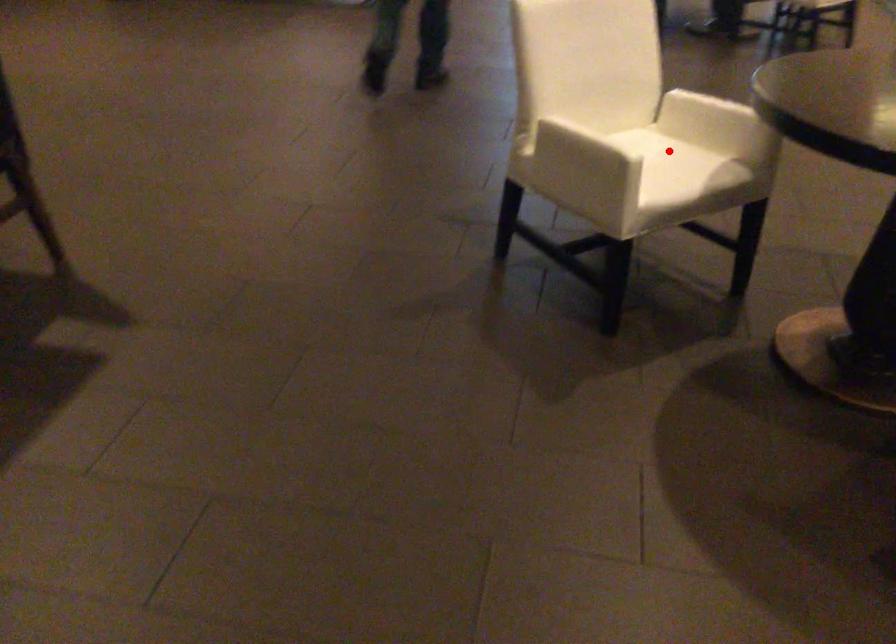
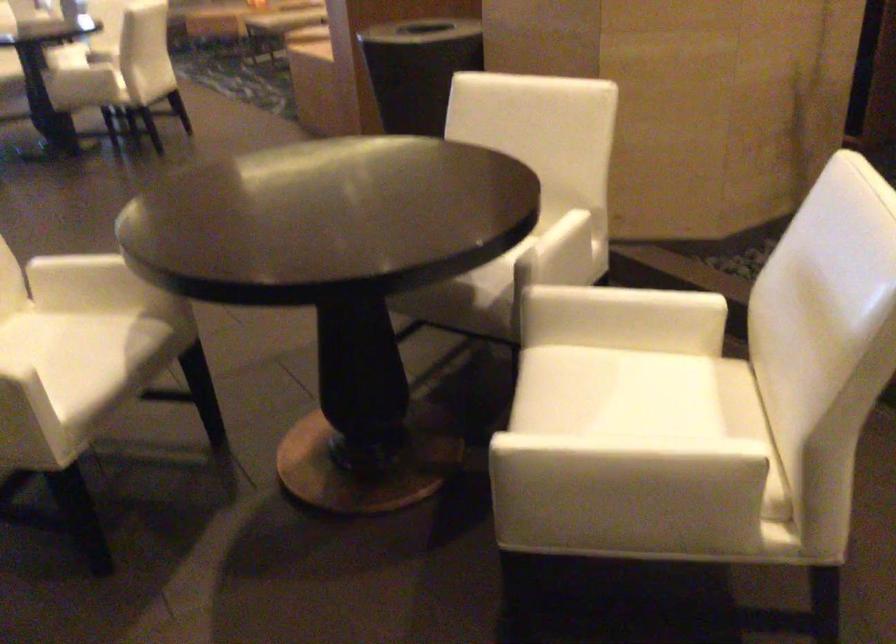
Question: A red point is marked in image1. In image2, is the corresponding 3D point closer to the camera or farther? Reply with the corresponding letter.

Choices:
 (A) The corresponding 3D point is closer.
 (B) The corresponding 3D point is farther.

Answer: (A)